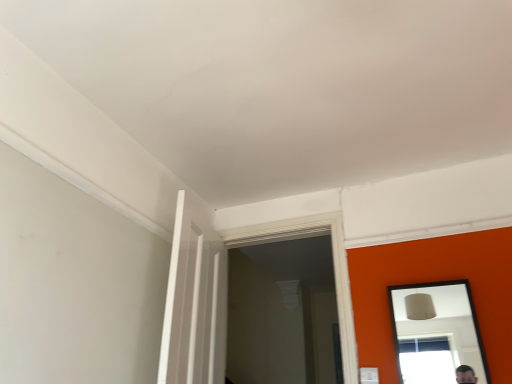
Identify the location of white glossy door at center. pyautogui.click(x=282, y=313).

Describe the element at coordinates (282, 313) in the screenshot. I see `white glossy door at center` at that location.

Where is `white glossy door at center`? Image resolution: width=512 pixels, height=384 pixels. white glossy door at center is located at coordinates 282,313.